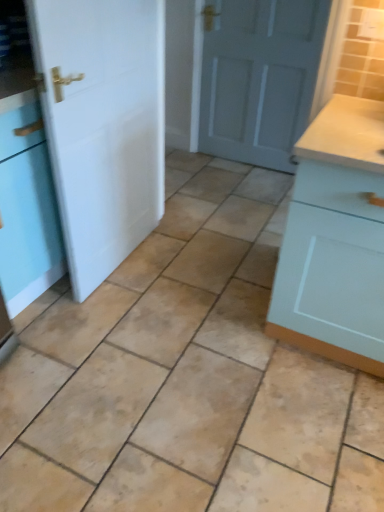
Where is `free location in front of light blue wood cabinet at right`? free location in front of light blue wood cabinet at right is located at coordinates 307,425.